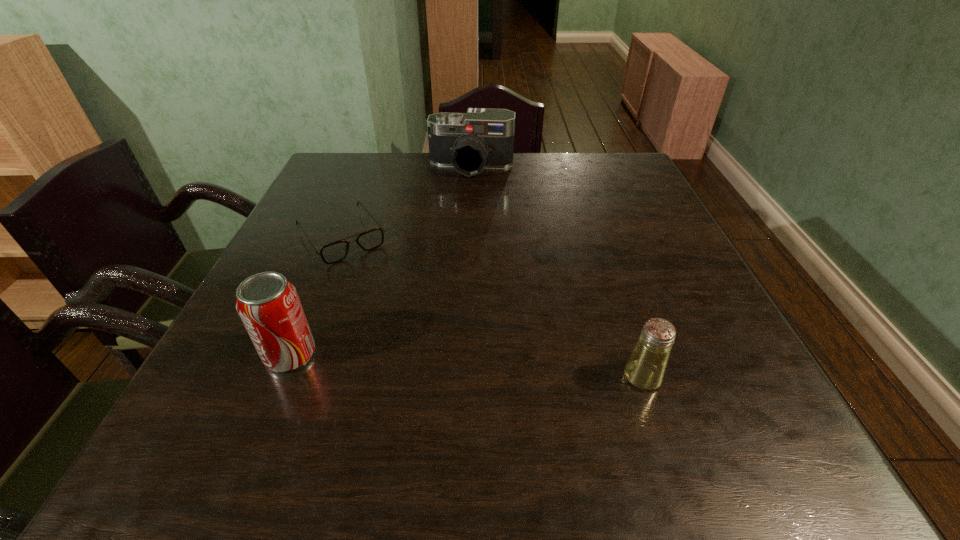
The image size is (960, 540). I want to click on free space located on the front-facing side of the sunglasses, so click(444, 379).

Locate an element on the screen. The width and height of the screenshot is (960, 540). vacant space located on the front-facing side of the sunglasses is located at coordinates (420, 345).

The height and width of the screenshot is (540, 960). I want to click on vacant area situated 0.190m on the front-facing side of the farthest object, so click(460, 216).

Find the location of a particular element. Image resolution: width=960 pixels, height=540 pixels. vacant space located on the front-facing side of the farthest object is located at coordinates (466, 191).

This screenshot has width=960, height=540. Identify the location of free region located on the front-facing side of the farthest object. (460, 214).

Find the location of a particular element. object that is at the far edge is located at coordinates (481, 138).

At what (x,y) coordinates should I click in order to perform the action: click on soda can present at the near edge. Please return your answer as a coordinate pair (x, y). This screenshot has width=960, height=540. Looking at the image, I should click on (268, 304).

I want to click on saltshaker positioned at the near edge, so click(x=645, y=369).

I want to click on soda can present at the left edge, so click(268, 304).

Locate an element on the screen. This screenshot has height=540, width=960. sunglasses that is at the left edge is located at coordinates (337, 251).